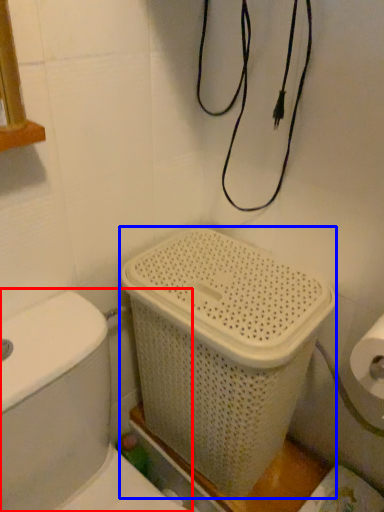
Question: Which object appears closest to the camera in this image, toilet (highlighted by a red box) or basket container (highlighted by a blue box)?

Choices:
 (A) toilet
 (B) basket container

Answer: (A)